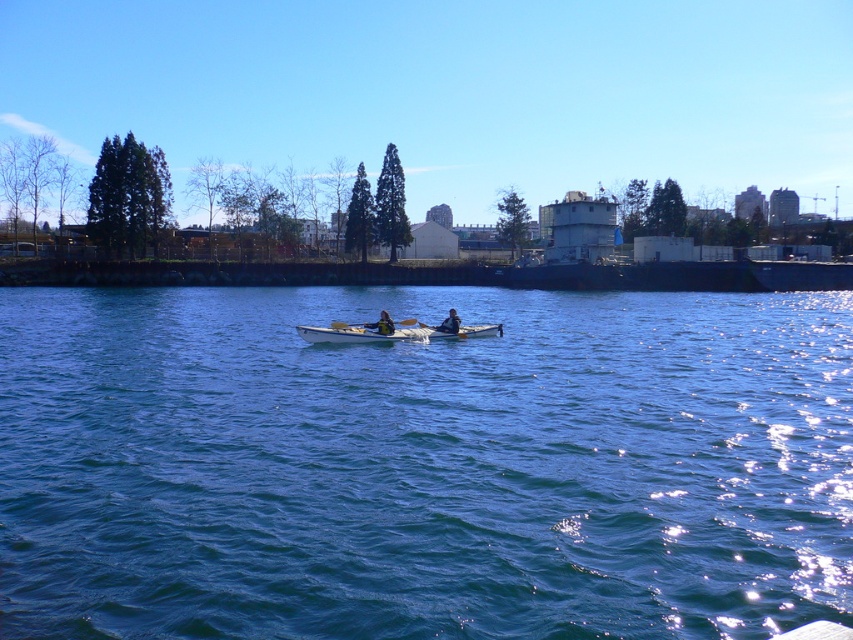
You are standing on the dock and want to place both the blue water at center and the white plastic paddle at center into a rectangular box. Which object should you place first to ensure they both fit?

The blue water at center is wider than the white plastic paddle at center. Therefore, you should place the blue water at center first to accommodate its greater width before placing the white plastic paddle at center.

You are standing on the dock and see the blue water at center and the white plastic paddle at center. Which object is closer to you?

The blue water at center is closer to the viewer than the white plastic paddle at center.

You are standing on the dock and see the blue water at center and the white plastic paddle at center. Which object is located to the right of the other?

The blue water at center is to the right of the white plastic paddle at center.